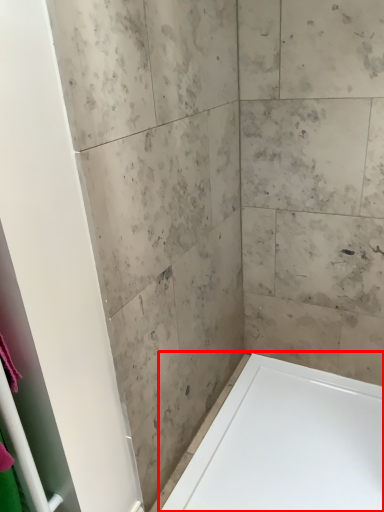
Question: In this image, where is bathtub (annotated by the red box) located relative to screen door?

Choices:
 (A) right
 (B) left

Answer: (A)